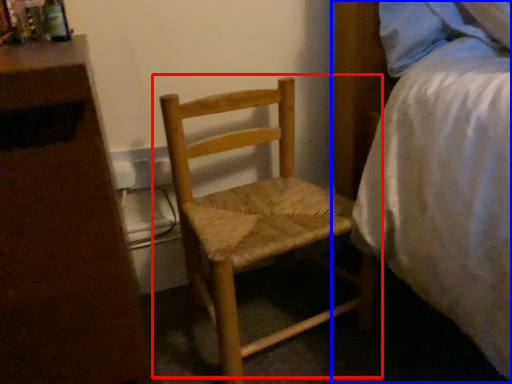
Question: Which object is further to the camera taking this photo, chair (highlighted by a red box) or bed (highlighted by a blue box)?

Choices:
 (A) chair
 (B) bed

Answer: (A)